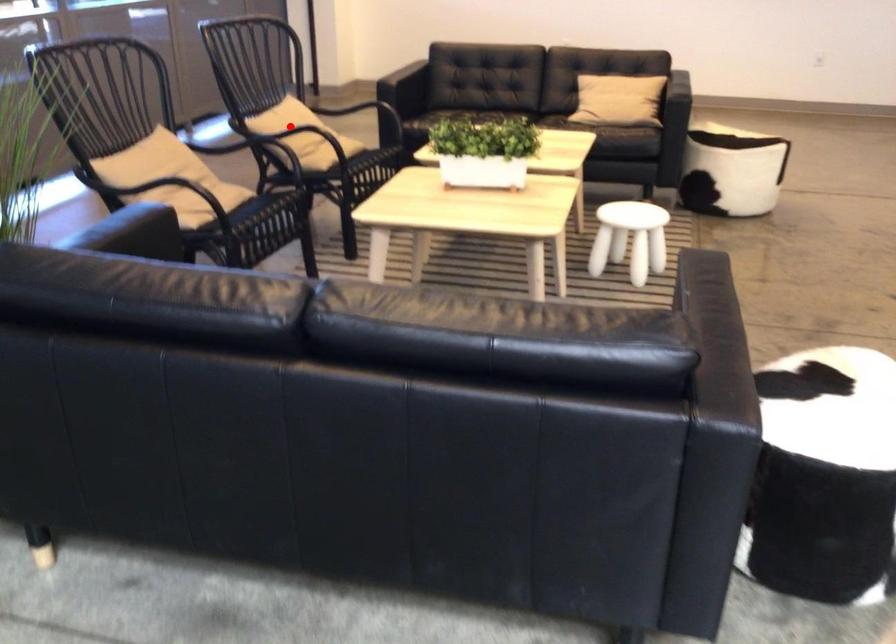
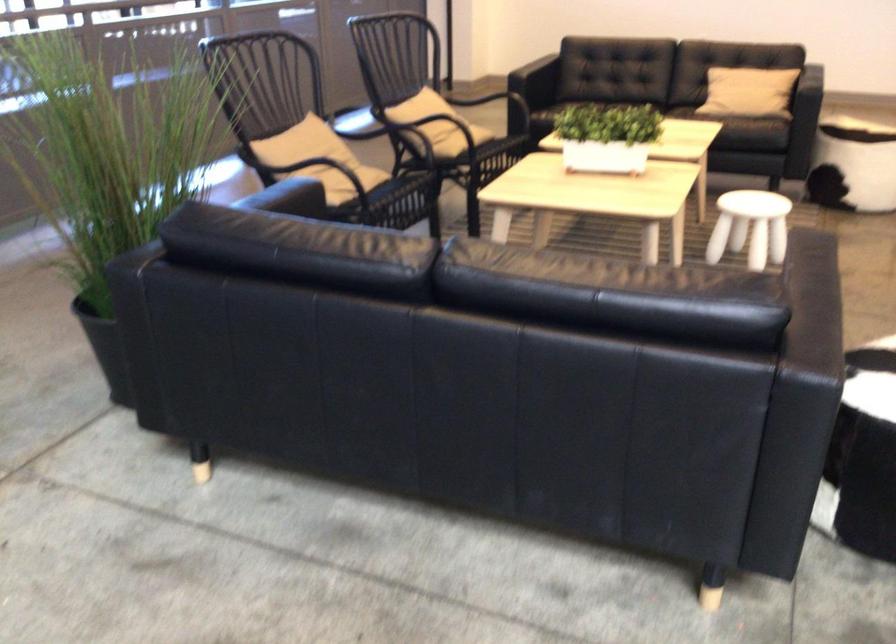
The point at the highlighted location is marked in the first image. Where is the corresponding point in the second image?

(431, 111)